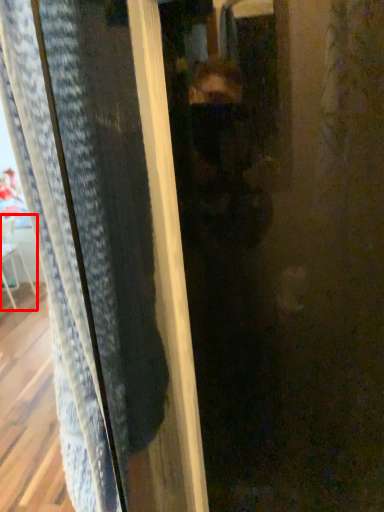
Question: From the image's perspective, where is armchair (annotated by the red box) located in relation to screen door in the image?

Choices:
 (A) above
 (B) below

Answer: (B)